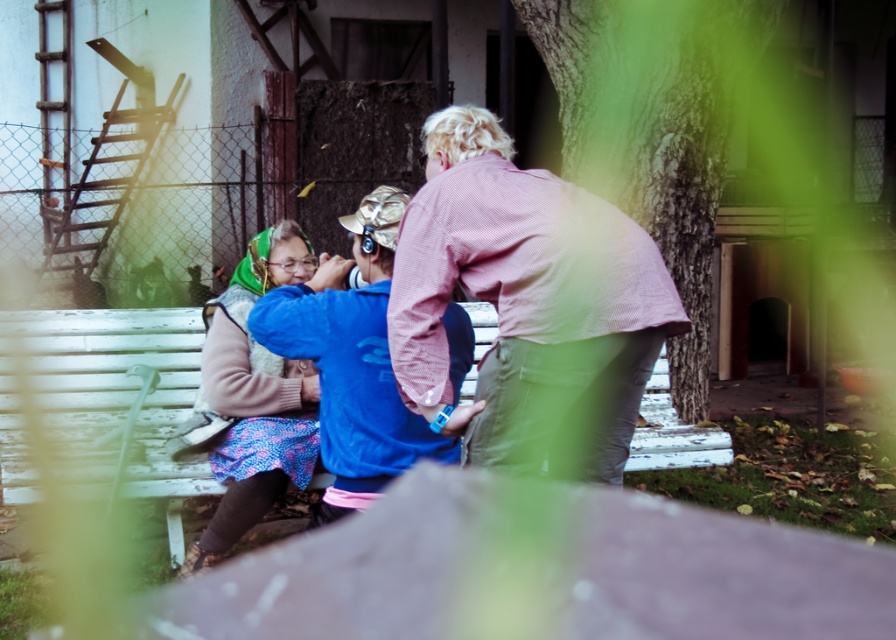
Question: Among these points, which one is farthest from the camera?

Choices:
 (A) (251, 458)
 (B) (326, 376)
 (C) (672, 314)

Answer: (A)

Question: Which of the following is the farthest from the observer?

Choices:
 (A) matte green scarf at left
 (B) white wooden bench at center
 (C) pink checkered shirt at center

Answer: (A)

Question: Is white wooden bench at center bigger than blue fleece jacket at center?

Choices:
 (A) no
 (B) yes

Answer: (B)

Question: Does blue fleece jacket at center appear over matte green scarf at left?

Choices:
 (A) yes
 (B) no

Answer: (A)

Question: Can you confirm if pink checkered shirt at center is positioned below blue fleece jacket at center?

Choices:
 (A) yes
 (B) no

Answer: (B)

Question: Which point is closer to the camera?

Choices:
 (A) (506, 337)
 (B) (139, 422)
 (C) (303, 476)

Answer: (A)